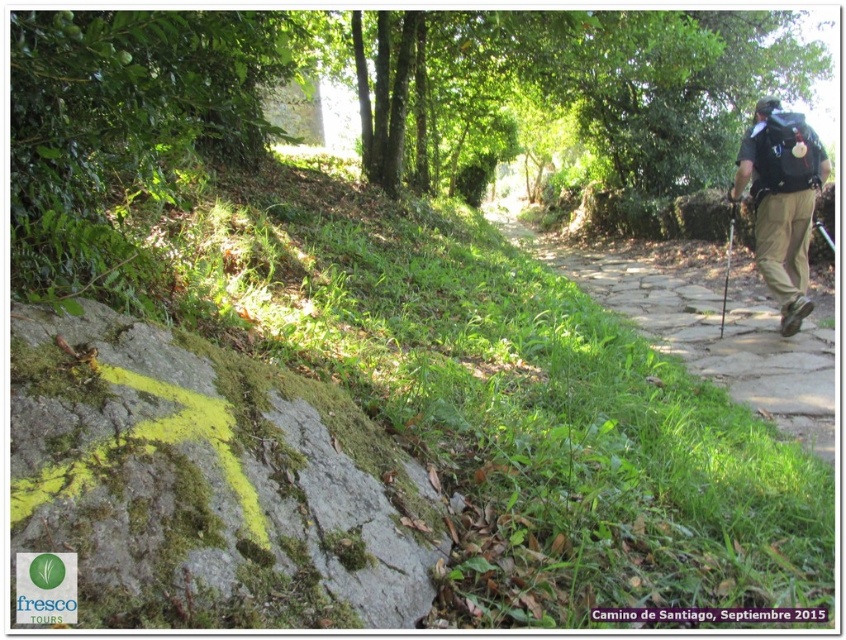
Question: Which of the following is the farthest from the observer?

Choices:
 (A) green mossy rock at lower left
 (B) dark gray backpack at right
 (C) brown stone path at right

Answer: (C)

Question: Is brown stone path at right further to camera compared to dark gray backpack at right?

Choices:
 (A) no
 (B) yes

Answer: (B)

Question: Based on their relative distances, which object is nearer to the brown stone path at right?

Choices:
 (A) dark gray backpack at right
 (B) green mossy rock at lower left

Answer: (A)

Question: From the image, what is the correct spatial relationship of brown stone path at right in relation to dark gray backpack at right?

Choices:
 (A) below
 (B) above

Answer: (A)

Question: Which point is farther to the camera?

Choices:
 (A) dark gray backpack at right
 (B) brown stone path at right

Answer: (B)

Question: Is green mossy rock at lower left to the left of brown stone path at right from the viewer's perspective?

Choices:
 (A) yes
 (B) no

Answer: (A)